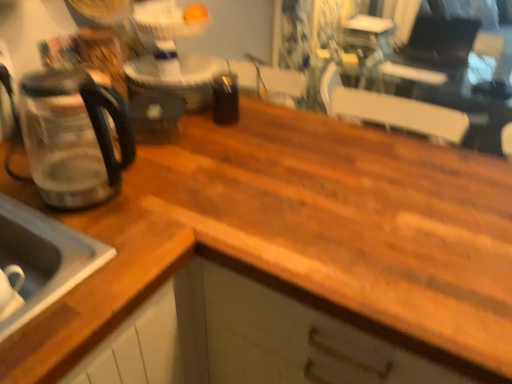
Question: Is satin silver sink at lower left at the left side of transparent glass coffeepot at left?

Choices:
 (A) no
 (B) yes

Answer: (B)

Question: From a real-world perspective, is satin silver sink at lower left physically below transparent glass coffeepot at left?

Choices:
 (A) yes
 (B) no

Answer: (A)

Question: Does satin silver sink at lower left appear on the right side of transparent glass coffeepot at left?

Choices:
 (A) no
 (B) yes

Answer: (A)

Question: From a real-world perspective, is satin silver sink at lower left over transparent glass coffeepot at left?

Choices:
 (A) no
 (B) yes

Answer: (A)

Question: Is satin silver sink at lower left not near transparent glass coffeepot at left?

Choices:
 (A) no
 (B) yes

Answer: (A)

Question: Considering the relative sizes of satin silver sink at lower left and transparent glass coffeepot at left in the image provided, is satin silver sink at lower left taller than transparent glass coffeepot at left?

Choices:
 (A) yes
 (B) no

Answer: (B)

Question: Can you confirm if transparent glass coffeepot at left is wider than satin silver sink at lower left?

Choices:
 (A) no
 (B) yes

Answer: (A)

Question: From the image's perspective, is transparent glass coffeepot at left above satin silver sink at lower left?

Choices:
 (A) yes
 (B) no

Answer: (A)

Question: Is transparent glass coffeepot at left outside satin silver sink at lower left?

Choices:
 (A) yes
 (B) no

Answer: (A)

Question: Is satin silver sink at lower left at the back of transparent glass coffeepot at left?

Choices:
 (A) no
 (B) yes

Answer: (A)

Question: Is transparent glass coffeepot at left further to the viewer compared to satin silver sink at lower left?

Choices:
 (A) no
 (B) yes

Answer: (B)

Question: Is there a large distance between transparent glass coffeepot at left and satin silver sink at lower left?

Choices:
 (A) no
 (B) yes

Answer: (A)

Question: Is satin silver sink at lower left taller or shorter than transparent glass coffeepot at left?

Choices:
 (A) short
 (B) tall

Answer: (A)